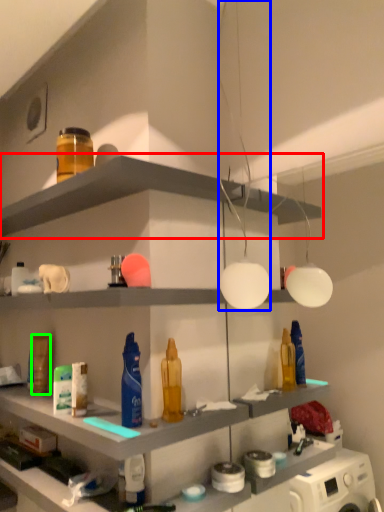
Question: Which is farther away from shelf (highlighted by a red box)? light fixture (highlighted by a blue box) or toiletry (highlighted by a green box)?

Choices:
 (A) light fixture
 (B) toiletry

Answer: (B)